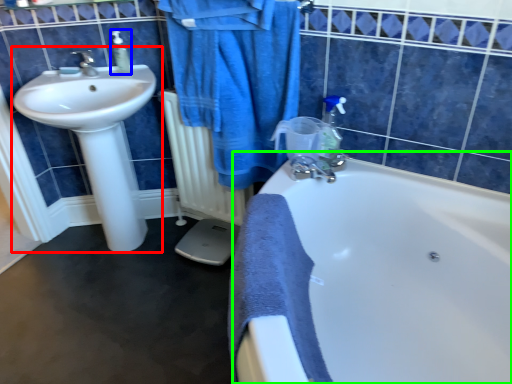
Question: Which object is positioned closest to sink (highlighted by a red box)? Select from soap dispenser (highlighted by a blue box) and bathtub (highlighted by a green box).

Choices:
 (A) soap dispenser
 (B) bathtub

Answer: (A)